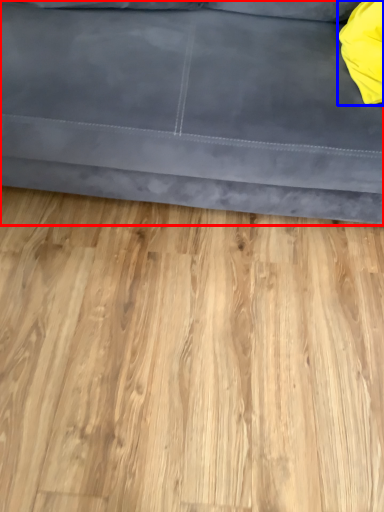
Question: Which point is further to the camera, studio couch (highlighted by a red box) or pillow (highlighted by a blue box)?

Choices:
 (A) studio couch
 (B) pillow

Answer: (B)